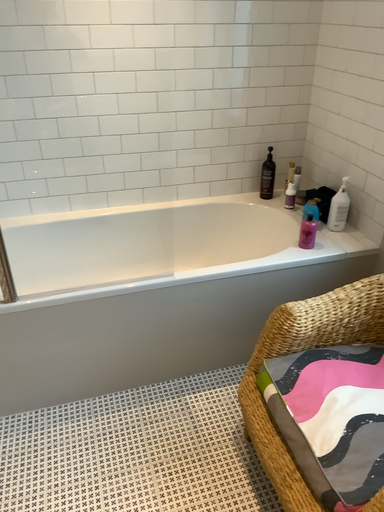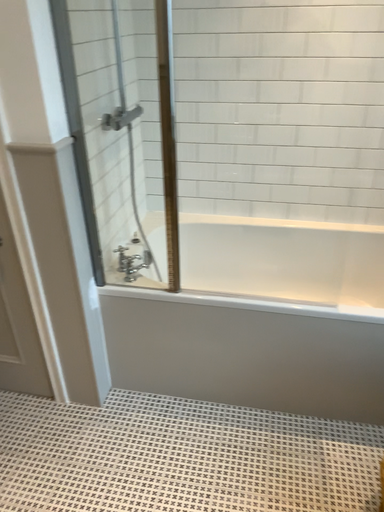
Question: How did the camera likely rotate when shooting the video?

Choices:
 (A) rotated left
 (B) rotated right

Answer: (A)